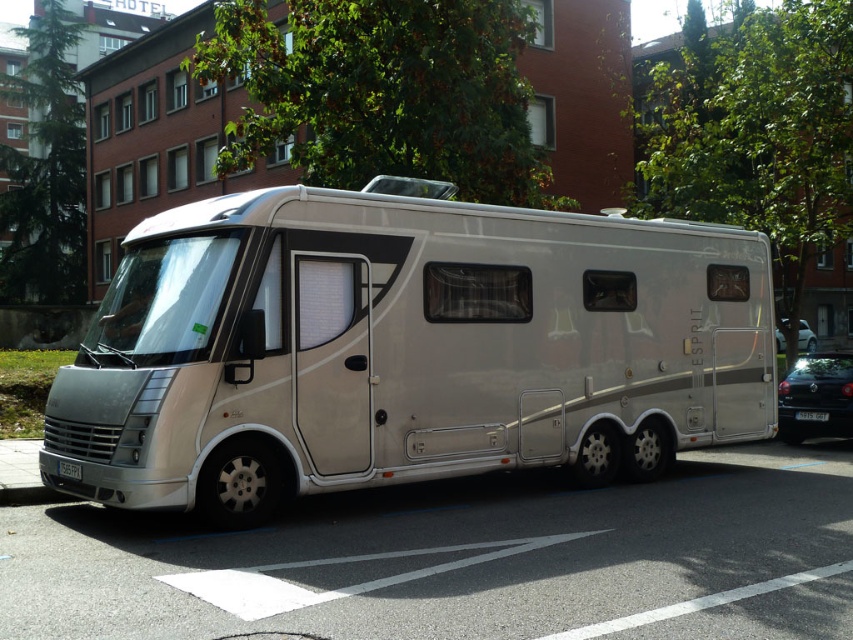
Question: Considering the real-world distances, which object is closest to the metallic silver car at right?

Choices:
 (A) black glossy sedan at lower right
 (B) white plastic license plate at lower center
 (C) silver metallic tour bus at center

Answer: (A)

Question: Does black glossy sedan at lower right have a greater width compared to metallic silver car at right?

Choices:
 (A) no
 (B) yes

Answer: (A)

Question: Which point is closer to the camera taking this photo?

Choices:
 (A) (643, 252)
 (B) (787, 390)

Answer: (A)

Question: Does black glossy sedan at lower right have a lesser width compared to black plastic license plate at lower center?

Choices:
 (A) yes
 (B) no

Answer: (B)

Question: Can you confirm if metallic silver car at right is smaller than black plastic license plate at lower center?

Choices:
 (A) no
 (B) yes

Answer: (A)

Question: Which object appears closest to the camera in this image?

Choices:
 (A) white plastic license plate at lower center
 (B) silver metallic tour bus at center
 (C) metallic silver car at right

Answer: (B)